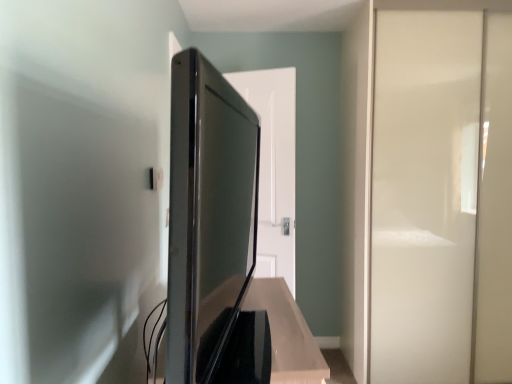
Locate an element on the screen. This screenshot has height=384, width=512. satin black tv at center is located at coordinates pos(212,231).

What do you see at coordinates (424, 194) in the screenshot? I see `white glossy screen door at right` at bounding box center [424, 194].

Measure the distance between white glossy screen door at right and camera.

2.40 meters.

At what (x,y) coordinates should I click in order to perform the action: click on satin black tv at center. Please return your answer as a coordinate pair (x, y). This screenshot has width=512, height=384. Looking at the image, I should click on (212, 231).

Can you confirm if white glossy screen door at right is smaller than satin black tv at center?

No, white glossy screen door at right is not smaller than satin black tv at center.

Consider the image. Is the position of white glossy screen door at right less distant than that of satin black tv at center?

That is False.

Is white glossy screen door at right wider than satin black tv at center?

Correct, the width of white glossy screen door at right exceeds that of satin black tv at center.

In terms of height, does white glossy screen door at right look taller or shorter compared to satin black tv at center?

Considering their sizes, white glossy screen door at right has more height than satin black tv at center.

Is white glossy door at center in contact with white glossy screen door at right?

white glossy door at center is not next to white glossy screen door at right, and they're not touching.

Between white glossy door at center and white glossy screen door at right, which one has larger width?

white glossy screen door at right.

Is white glossy door at center not inside white glossy screen door at right?

Yes, white glossy door at center is located beyond the bounds of white glossy screen door at right.

From the picture: From the image's perspective, between white glossy door at center and white glossy screen door at right, which one is located above?

From the image's view, white glossy screen door at right is above.

Does white glossy door at center have a lesser height compared to satin black tv at center?

No.

The image size is (512, 384). In order to click on door that appears behind the satin black tv at center in this screenshot , I will do `click(274, 167)`.

What's the angular difference between white glossy door at center and satin black tv at center's facing directions?

The angle between the facing direction of white glossy door at center and the facing direction of satin black tv at center is 108 degrees.

Which is closer to the camera, (264, 176) or (222, 296)?

Point (222, 296)

Are satin black tv at center and white glossy door at center located far from each other?

Yes, satin black tv at center and white glossy door at center are quite far apart.

Considering the sizes of satin black tv at center and white glossy door at center in the image, is satin black tv at center taller or shorter than white glossy door at center?

Clearly, satin black tv at center is shorter compared to white glossy door at center.

In the image, there is a satin black tv at center. At what (x,y) coordinates should I click in order to perform the action: click on door above it (from the image's perspective). Please return your answer as a coordinate pair (x, y). This screenshot has height=384, width=512. Looking at the image, I should click on (274, 167).

Is the surface of satin black tv at center in direct contact with white glossy screen door at right?

No.

Does satin black tv at center have a lesser width compared to white glossy screen door at right?

Indeed, satin black tv at center has a lesser width compared to white glossy screen door at right.

Is point (220, 287) in front of point (372, 154)?

Yes.

Is white glossy screen door at right inside satin black tv at center?

No, white glossy screen door at right is not inside satin black tv at center.

Between white glossy screen door at right and white glossy door at center, which one has larger size?

Bigger between the two is white glossy screen door at right.

Is white glossy screen door at right facing away from white glossy door at center?

That's not correct — white glossy screen door at right is not looking away from white glossy door at center.

Locate an element on the screen. This screenshot has height=384, width=512. screen door on the right of satin black tv at center is located at coordinates (424, 194).

I want to click on screen door in front of the white glossy door at center, so click(424, 194).

Based on their spatial positions, is satin black tv at center or white glossy screen door at right further from white glossy door at center?

The object further to white glossy door at center is satin black tv at center.

Looking at the image, which one is located further to white glossy screen door at right, white glossy door at center or satin black tv at center?

Among the two, satin black tv at center is located further to white glossy screen door at right.

When comparing their distances from satin black tv at center, does white glossy screen door at right or white glossy door at center seem further?

white glossy screen door at right lies further to satin black tv at center than the other object.

From the image, which object appears to be farther from white glossy screen door at right, satin black tv at center or white glossy door at center?

Among the two, satin black tv at center is located further to white glossy screen door at right.

Looking at the image, which one is located further to satin black tv at center, white glossy door at center or white glossy screen door at right?

Based on the image, white glossy screen door at right appears to be further to satin black tv at center.

Considering their positions, is white glossy screen door at right positioned further to white glossy door at center than satin black tv at center?

Among the two, satin black tv at center is located further to white glossy door at center.

Locate an element on the screen. The width and height of the screenshot is (512, 384). screen door positioned between satin black tv at center and white glossy door at center from near to far is located at coordinates (424, 194).